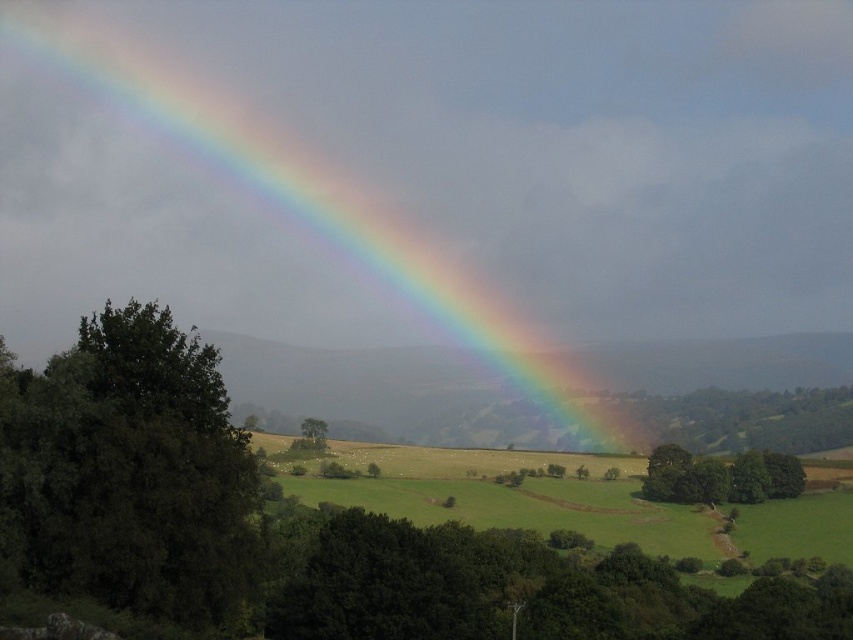
Does point (779, 602) come farther from viewer compared to point (537, 525)?

No, (779, 602) is in front of (537, 525).

Can you confirm if green leafy tree at lower center is shorter than green grassy field at center?

No.

What are the coordinates of `green leafy tree at lower center` in the screenshot? It's located at (526, 589).

I want to click on green leafy tree at lower center, so click(526, 589).

Which is more to the right, rainbow at upper left or green leafy tree at center?

Positioned to the right is rainbow at upper left.

Which is behind, point (397, 140) or point (316, 422)?

The point (397, 140) is more distant.

What do you see at coordinates (424, 188) in the screenshot? The image size is (853, 640). I see `rainbow at upper left` at bounding box center [424, 188].

Identify the location of rainbow at upper left. (424, 188).

Between green leafy tree at lower center and green leafy tree at center, which one is positioned lower?

green leafy tree at lower center is lower down.

Who is taller, green leafy tree at lower center or green leafy tree at center?

Standing taller between the two is green leafy tree at lower center.

Image resolution: width=853 pixels, height=640 pixels. What are the coordinates of `green leafy tree at lower center` in the screenshot? It's located at (526, 589).

You are a GUI agent. You are given a task and a screenshot of the screen. Output one action in this format:
    pyautogui.click(x=<x>, y=<y>)
    Task: Click on the green leafy tree at lower center
    The height and width of the screenshot is (640, 853).
    Given the screenshot: What is the action you would take?
    click(x=526, y=589)